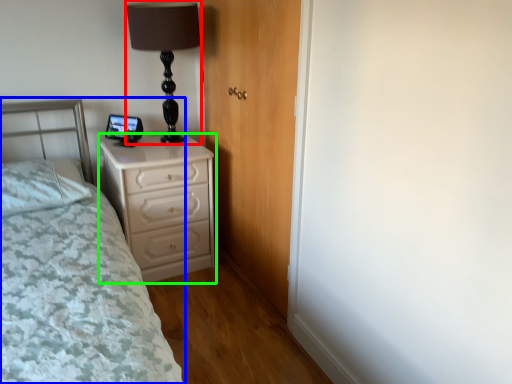
Question: Considering the real-world distances, which object is closest to table lamp (highlighted by a red box)? bed (highlighted by a blue box) or chest of drawers (highlighted by a green box).

Choices:
 (A) bed
 (B) chest of drawers

Answer: (B)